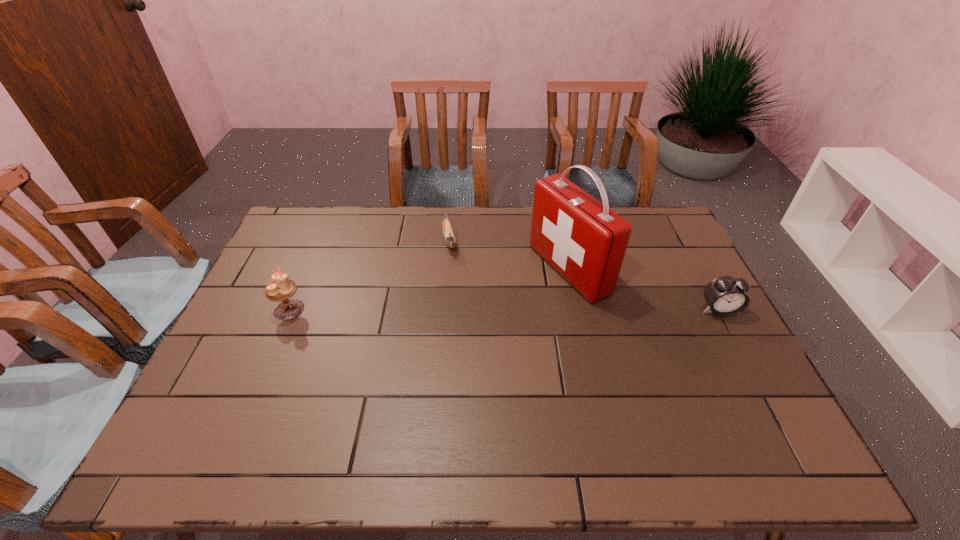
This screenshot has width=960, height=540. In order to click on free space at the far edge of the desktop in this screenshot , I will do coord(513,242).

Where is `vacant space at the near edge of the desktop`? This screenshot has height=540, width=960. vacant space at the near edge of the desktop is located at coordinates coord(492,396).

Find the location of a particular element. vacant space at the right edge is located at coordinates (708, 357).

Where is `vacant position at the far right corner of the desktop`? Image resolution: width=960 pixels, height=540 pixels. vacant position at the far right corner of the desktop is located at coordinates (664, 212).

Locate an element on the screen. This screenshot has width=960, height=540. free location at the near right corner of the desktop is located at coordinates (735, 414).

This screenshot has height=540, width=960. In order to click on vacant space that is in between the tallest object and the third shortest object in this screenshot , I will do `click(429, 289)`.

I want to click on empty location between the third object from left to right and the third shortest object, so click(x=429, y=289).

Find the location of a particular element. vacant region between the candle holder and the shortest object is located at coordinates (370, 275).

The height and width of the screenshot is (540, 960). Identify the location of vacant area that lies between the third tallest object and the first-aid kit. (644, 289).

Find the location of a particular element. This screenshot has width=960, height=540. free space between the leftmost object and the third object from right to left is located at coordinates (370, 275).